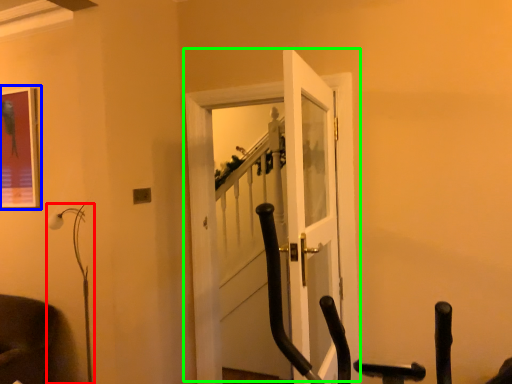
Question: Considering the real-world distances, which object is closest to lamp (highlighted by a red box)? picture frame (highlighted by a blue box) or door (highlighted by a green box).

Choices:
 (A) picture frame
 (B) door

Answer: (A)